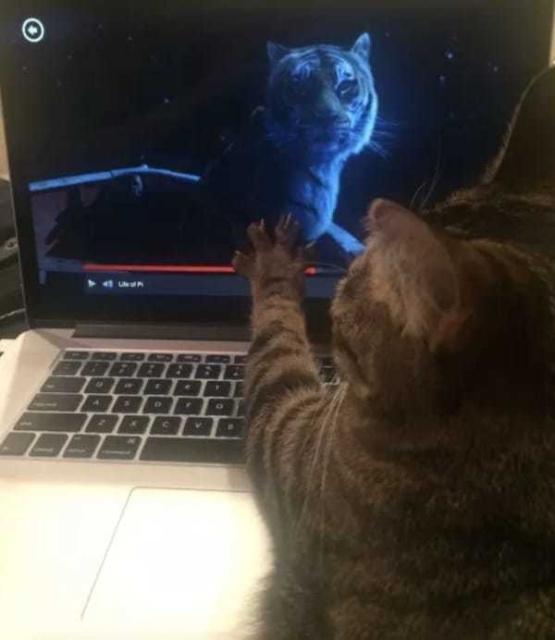
Find the location of a particular element. The width and height of the screenshot is (555, 640). mousepad is located at coordinates (179, 540).